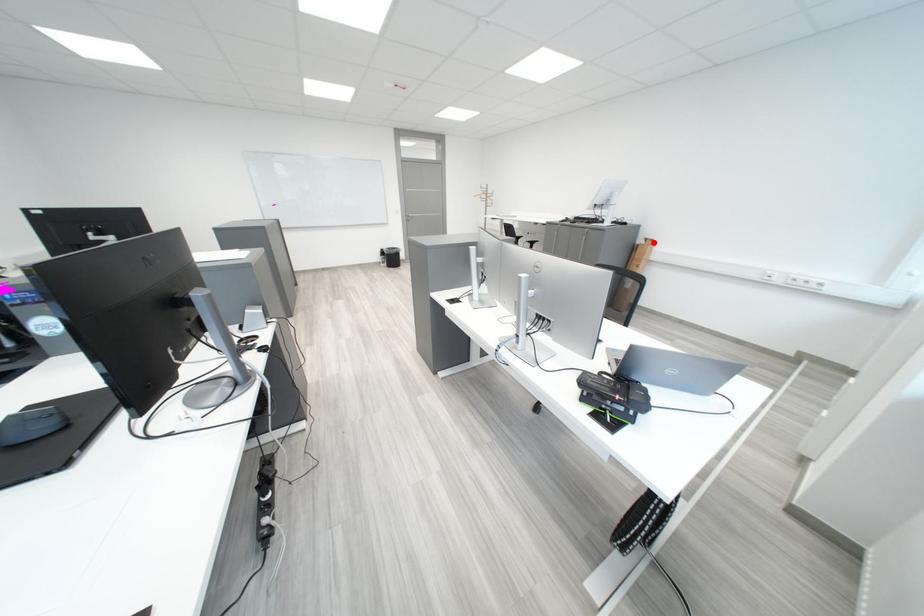
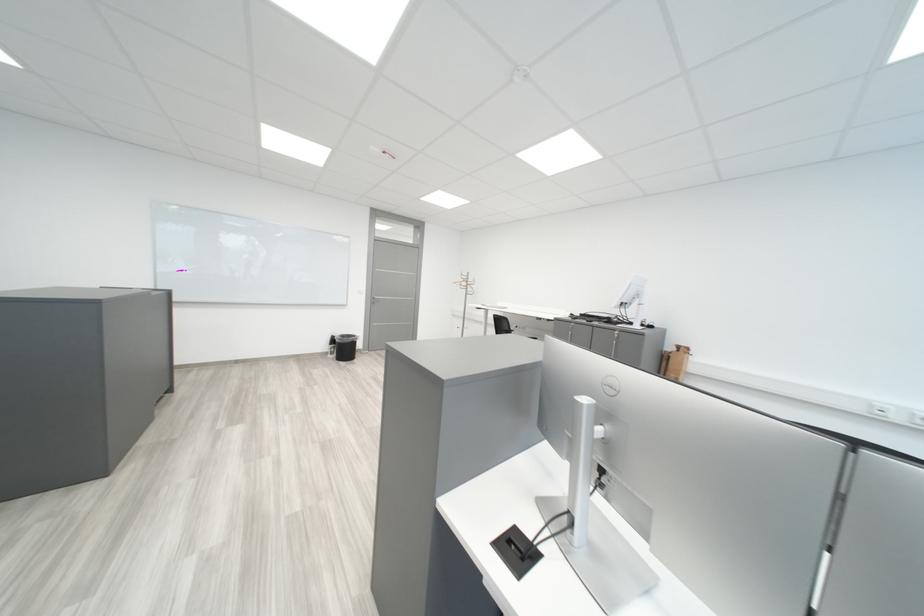
Where in the second image is the point corresponding to the highlighted location from the first image?

(684, 349)